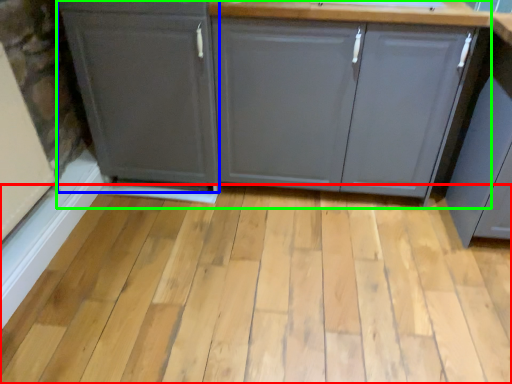
Question: Which object is the farthest from plank (highlighted by a red box)? Choose among these: cabinetry (highlighted by a blue box) or cabinetry (highlighted by a green box).

Choices:
 (A) cabinetry
 (B) cabinetry

Answer: (A)